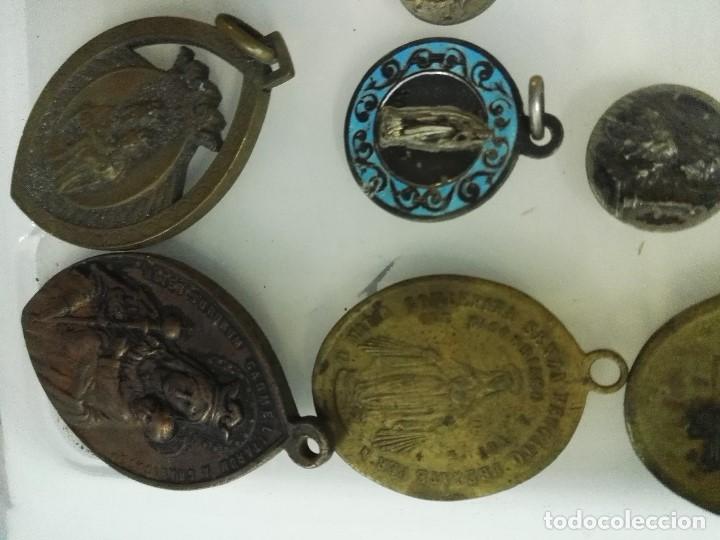
Locate an element on the screen. The image size is (720, 540). pendants is located at coordinates (405, 391), (198, 373), (677, 395), (651, 176), (402, 139), (433, 6), (109, 117).